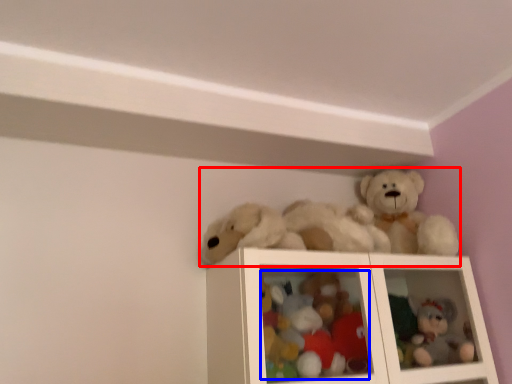
Question: Which of the following is the farthest to the observer, toy (highlighted by a red box) or toy (highlighted by a blue box)?

Choices:
 (A) toy
 (B) toy

Answer: (B)